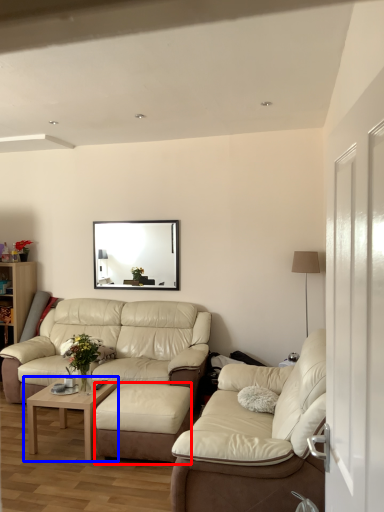
Question: Which object is further to the camera taking this photo, footrest (highlighted by a red box) or coffee table (highlighted by a blue box)?

Choices:
 (A) footrest
 (B) coffee table

Answer: (B)